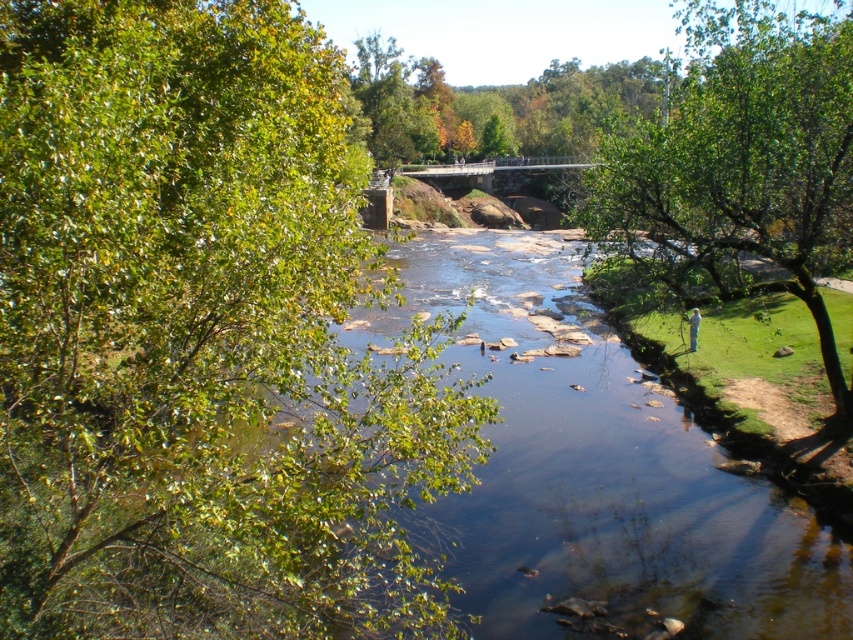
Is green leafy tree at left below green leafy tree at lower right?

Yes.

Between green leafy tree at left and green leafy tree at lower right, which one appears on the left side from the viewer's perspective?

green leafy tree at left is more to the left.

Does point (323, 138) lie in front of point (840, 81)?

That is True.

I want to click on green leafy tree at left, so click(x=201, y=339).